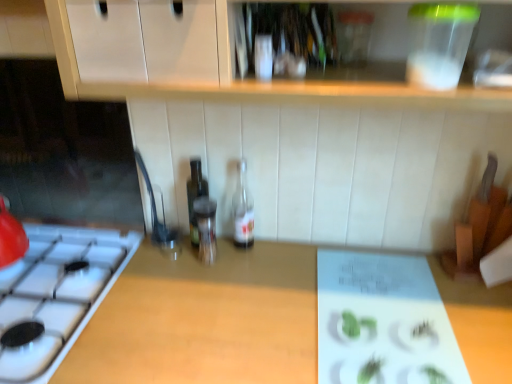
Locate an element on the screen. free space to the right of transparent glass bottle at center, which is the 2th bottle from left to right is located at coordinates (261, 267).